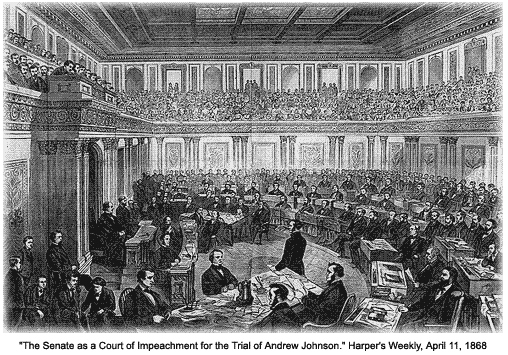
Identify the location of door. (221, 82).